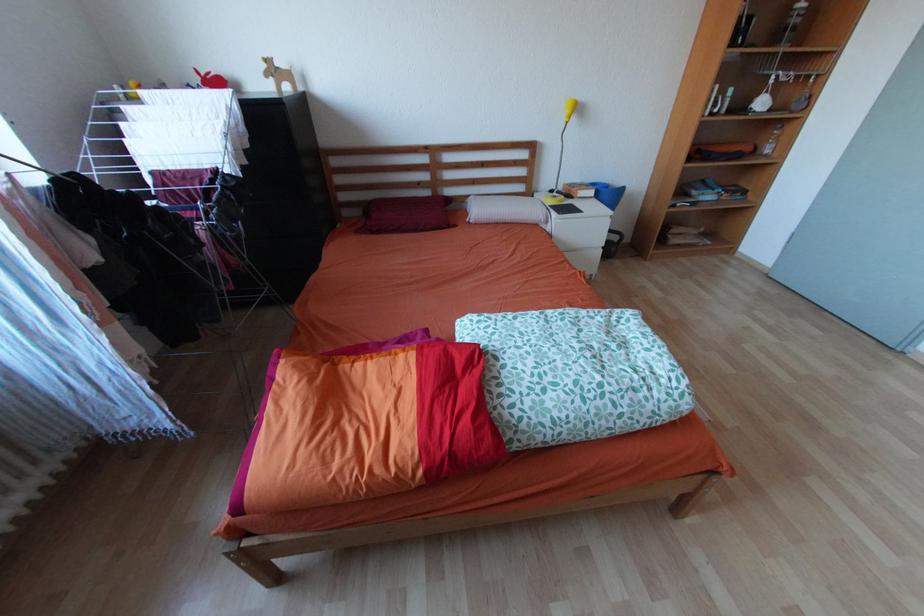
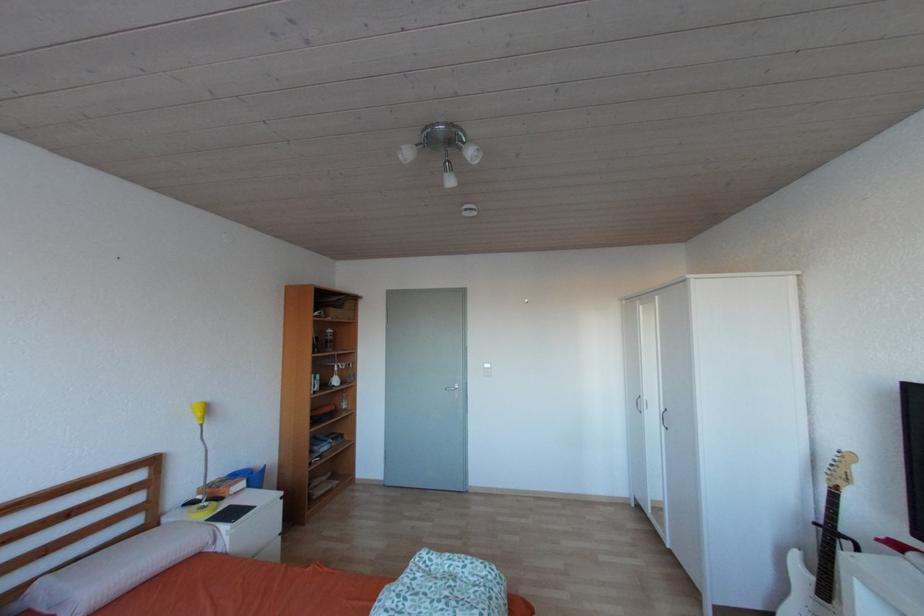
Question: Based on the continuous images, in which direction is the camera rotating? Reply with the corresponding letter.

Choices:
 (A) Left
 (B) Right
 (C) Up
 (D) Down

Answer: (B)